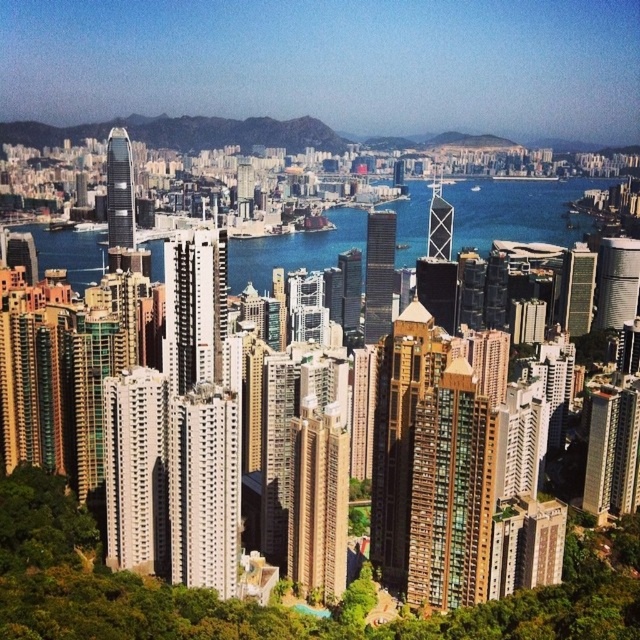
You are a drone operator who needs to deliver a package from the blue glassy water at center to the matte glass building at center. What is the minimum distance you need to fly between them?

The minimum distance you need to fly between the blue glassy water at center and the matte glass building at center is 229.69 meters.

You are a drone operator tasked with flying a drone between two skyscrapers in the city. The drone has a 10 feet wingspan. Given the distance between the glassy brown skyscraper at center and the glassy steel skyscraper at center, can the drone safely navigate through the space between them?

The distance between the glassy brown skyscraper at center and the glassy steel skyscraper at center is 470.12 feet. Since the drone has a wingspan of only 10 feet, there is ample space for it to safely navigate through the gap between them.

You are a drone operator planning to fly a drone from your current position to the glassy brown skyscraper at center. The drone has a maximum flight range of 150 meters. Based on the scene, will the drone be able to reach the skyscraper?

The distance between the glassy brown skyscraper at center and the viewer is 155.36 meters, which exceeds the drone maximum flight range of 150 meters. Therefore, the drone cannot reach the skyscraper.